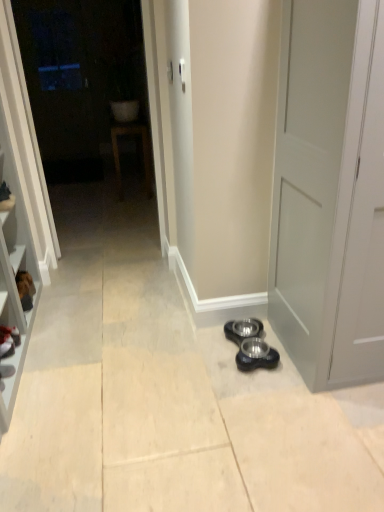
Question: From a real-world perspective, is black leather shoe at left positioned above or below transparent glass door at upper left?

Choices:
 (A) below
 (B) above

Answer: (A)

Question: Visually, is black leather shoe at left positioned to the left or to the right of transparent glass door at upper left?

Choices:
 (A) right
 (B) left

Answer: (B)

Question: Which object is the farthest from the matte white sink at upper center?

Choices:
 (A) transparent glass door at upper left
 (B) black rubber bowls at lower center
 (C) black leather shoe at left
 (D) satin silver door handle at upper center

Answer: (B)

Question: Considering the real-world distances, which object is closest to the transparent glass door at upper left?

Choices:
 (A) matte white sink at upper center
 (B) black leather shoe at left
 (C) satin silver door handle at upper center
 (D) black rubber bowls at lower center

Answer: (A)